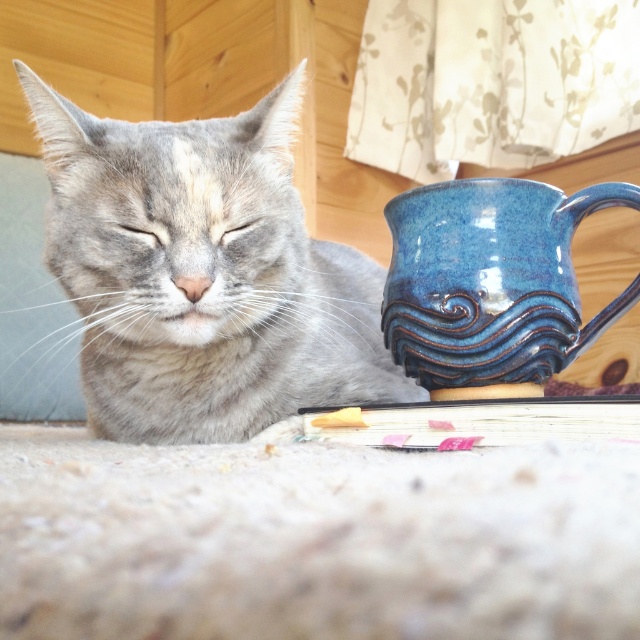
Question: Can you confirm if gray soft fur cat at left is positioned below gray fur eye at center?

Choices:
 (A) yes
 (B) no

Answer: (A)

Question: Among these points, which one is farthest from the camera?

Choices:
 (A) coord(474,269)
 (B) coord(244,230)
 (C) coord(282,108)
 (D) coord(150,236)

Answer: (C)

Question: Is blue glazed mug at right in front of gray fur eye at upper left?

Choices:
 (A) yes
 (B) no

Answer: (A)

Question: Is gray soft fur cat at left closer to the viewer compared to gray fur eye at upper left?

Choices:
 (A) no
 (B) yes

Answer: (B)

Question: Estimate the real-world distances between objects in this image. Which object is farther from the gray fur eye at upper left?

Choices:
 (A) gray fur eye at center
 (B) blue glazed mug at right
 (C) gray soft fur cat at left

Answer: (B)

Question: Estimate the real-world distances between objects in this image. Which object is closer to the gray soft fur cat at left?

Choices:
 (A) gray fur eye at upper left
 (B) blue glazed mug at right

Answer: (A)